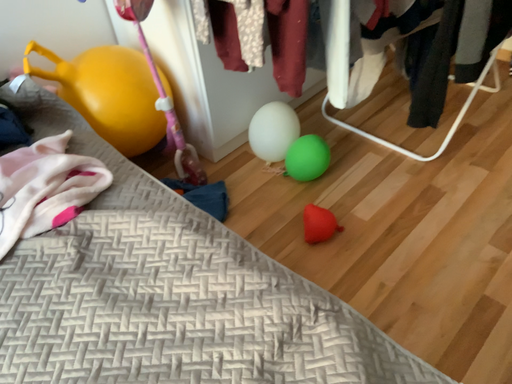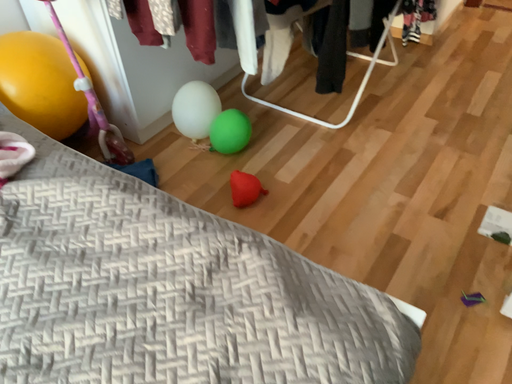
Question: Which way did the camera rotate in the video?

Choices:
 (A) rotated left
 (B) rotated right

Answer: (B)